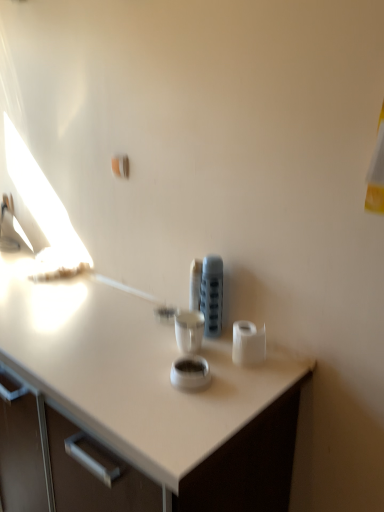
Question: Considering the relative sizes of matte plastic container at center and white matte toilet paper at right in the image provided, is matte plastic container at center taller than white matte toilet paper at right?

Choices:
 (A) no
 (B) yes

Answer: (B)

Question: Is white matte toilet paper at right at the back of matte plastic container at center?

Choices:
 (A) no
 (B) yes

Answer: (A)

Question: From a real-world perspective, is matte plastic container at center below white matte toilet paper at right?

Choices:
 (A) no
 (B) yes

Answer: (A)

Question: Is matte plastic container at center to the left of white matte toilet paper at right from the viewer's perspective?

Choices:
 (A) no
 (B) yes

Answer: (B)

Question: From the image's perspective, would you say matte plastic container at center is positioned over white matte toilet paper at right?

Choices:
 (A) no
 (B) yes

Answer: (B)

Question: Would you say matte plastic container at center contains white matte toilet paper at right?

Choices:
 (A) no
 (B) yes

Answer: (A)

Question: Is white matte toilet paper at right located outside matte plastic container at center?

Choices:
 (A) no
 (B) yes

Answer: (B)

Question: Is white matte toilet paper at right oriented towards matte plastic container at center?

Choices:
 (A) no
 (B) yes

Answer: (A)

Question: Does white matte toilet paper at right lie in front of matte plastic container at center?

Choices:
 (A) yes
 (B) no

Answer: (A)

Question: Is white matte toilet paper at right thinner than matte plastic container at center?

Choices:
 (A) yes
 (B) no

Answer: (B)

Question: Can you confirm if white matte toilet paper at right is taller than matte plastic container at center?

Choices:
 (A) no
 (B) yes

Answer: (A)

Question: From a real-world perspective, is white matte toilet paper at right on top of matte plastic container at center?

Choices:
 (A) yes
 (B) no

Answer: (B)

Question: Is matte plastic container at center to the left or to the right of white matte toilet paper at right in the image?

Choices:
 (A) right
 (B) left

Answer: (B)